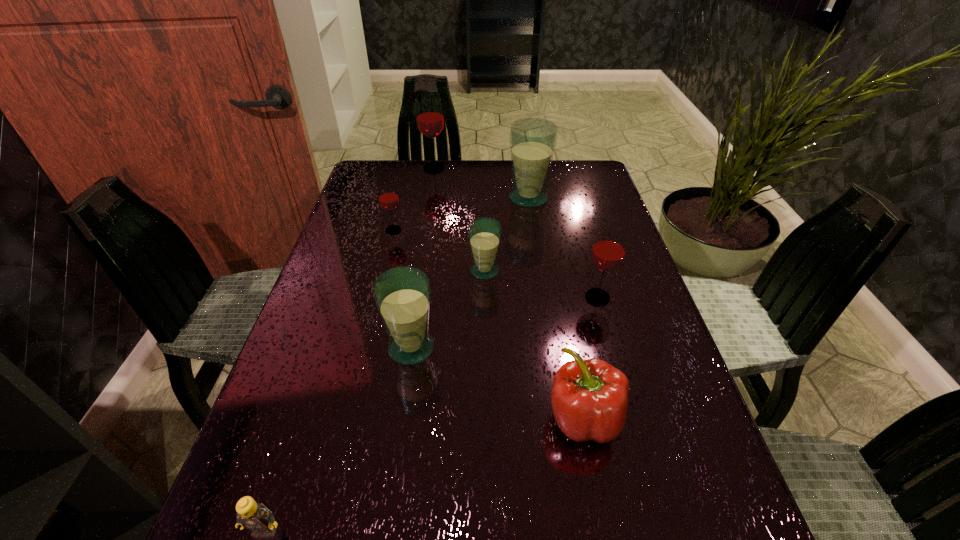
Find the location of a particular element. The width and height of the screenshot is (960, 540). vacant area that lies between the second farthest object and the fourth farthest glass is located at coordinates (506, 235).

Identify the location of unoccupied position between the sixth farthest object and the second biggest red glass. Image resolution: width=960 pixels, height=540 pixels. tap(504, 323).

Choose which object is the nearest neighbor to the second blue glass from left to right. Please provide its 2D coordinates. Your answer should be formatted as a tuple, i.e. [(x, y)], where the tuple contains the x and y coordinates of a point satisfying the conditions above.

[(402, 295)]

Select which object appears as the fourth closest to the rightmost glass. Please provide its 2D coordinates. Your answer should be formatted as a tuple, i.e. [(x, y)], where the tuple contains the x and y coordinates of a point satisfying the conditions above.

[(402, 295)]

Where is `glass that can be found as the third closest to the sixth nearest object`? The height and width of the screenshot is (540, 960). glass that can be found as the third closest to the sixth nearest object is located at coordinates (532, 140).

Locate an element on the screen. The image size is (960, 540). glass that is the fifth closest one to the second nearest object is located at coordinates (532, 140).

Choose which red glass is the second nearest neighbor to the second glass from right to left. Please provide its 2D coordinates. Your answer should be formatted as a tuple, i.e. [(x, y)], where the tuple contains the x and y coordinates of a point satisfying the conditions above.

[(388, 198)]

Identify which red glass is the second nearest to the shortest object. Please provide its 2D coordinates. Your answer should be formatted as a tuple, i.e. [(x, y)], where the tuple contains the x and y coordinates of a point satisfying the conditions above.

[(388, 198)]

The height and width of the screenshot is (540, 960). Identify the location of blue glass that stands as the second closest to the second farthest glass. (402, 295).

I want to click on the second closest blue glass relative to the nearest glass, so click(x=532, y=140).